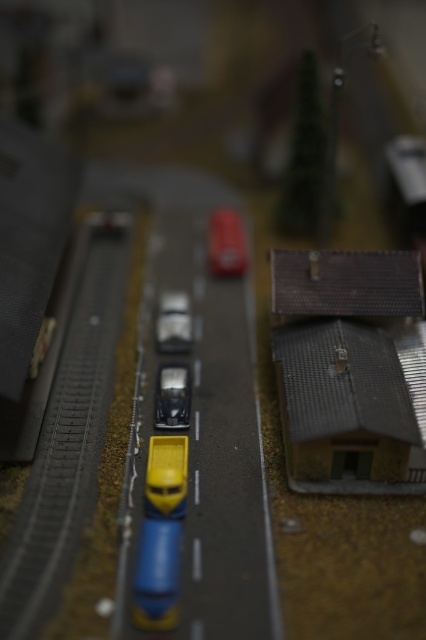
Is smooth gray train track at center closer to camera compared to shiny silver car at center?

Yes.

In the scene shown: Who is more distant from viewer, (86, 452) or (175, 406)?

The point (175, 406) is more distant.

Is point (69, 529) farther from camera compared to point (166, 365)?

No, (69, 529) is closer to viewer.

What are the coordinates of `smooth gray train track at center` in the screenshot? It's located at (74, 426).

Is brown textured roof at right to the left of matte red car at center from the viewer's perspective?

Incorrect, brown textured roof at right is not on the left side of matte red car at center.

Does brown textured roof at right have a lesser width compared to matte red car at center?

No.

You are a GUI agent. You are given a task and a screenshot of the screen. Output one action in this format:
    pyautogui.click(x=<x>, y=<y>)
    Task: Click on the brown textured roof at right
    The height and width of the screenshot is (640, 426).
    Given the screenshot: What is the action you would take?
    pyautogui.click(x=350, y=369)

Does point (210, 266) come closer to viewer compared to point (186, 403)?

No, it is not.

Where is `matte red car at center`? The image size is (426, 640). matte red car at center is located at coordinates (227, 243).

Where is `matte red car at center`? Image resolution: width=426 pixels, height=640 pixels. matte red car at center is located at coordinates (227, 243).

Image resolution: width=426 pixels, height=640 pixels. I want to click on matte red car at center, so click(227, 243).